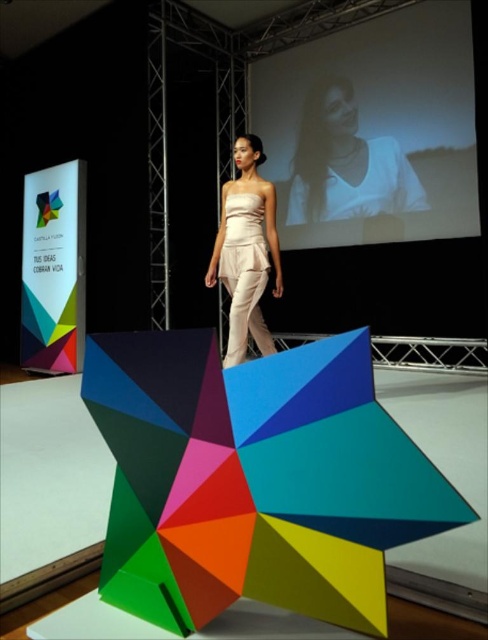
Question: Is white matte shirt at upper center smaller than matte white dress at center?

Choices:
 (A) no
 (B) yes

Answer: (A)

Question: Is white matte shirt at upper center below matte white dress at center?

Choices:
 (A) yes
 (B) no

Answer: (B)

Question: Does white matte shirt at upper center have a smaller size compared to matte white dress at center?

Choices:
 (A) yes
 (B) no

Answer: (B)

Question: Among these points, which one is nearest to the camera?

Choices:
 (A) (397, 173)
 (B) (211, 273)

Answer: (B)

Question: Which of the following is the closest to the observer?

Choices:
 (A) white matte shirt at upper center
 (B) matte white dress at center

Answer: (B)